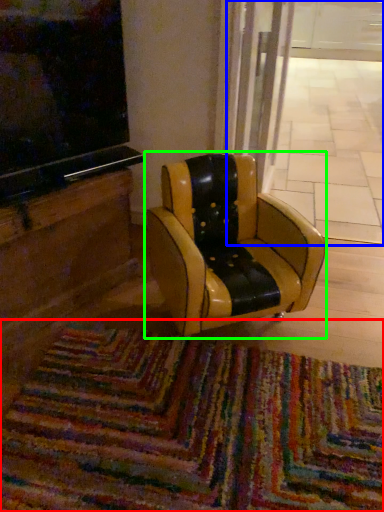
Question: Which object is positioned farthest from mat (highlighted by a red box)? Select from shop window (highlighted by a blue box) and chair (highlighted by a green box).

Choices:
 (A) shop window
 (B) chair

Answer: (A)